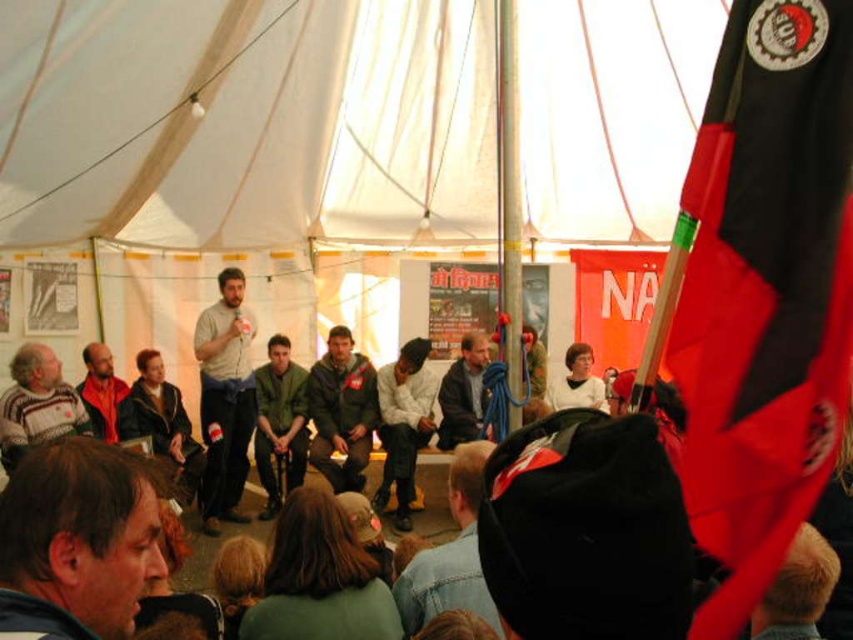
You are a photographer at the event and want to capture a photo that includes both the light gray cotton shirt at center and the denim jacket at lower center. Based on their positions, which one should you focus on first to ensure both are in the frame?

The light gray cotton shirt at center is positioned on the left side of the denim jacket at lower center, so you should focus on the denim jacket at lower center first to ensure both are in the frame.